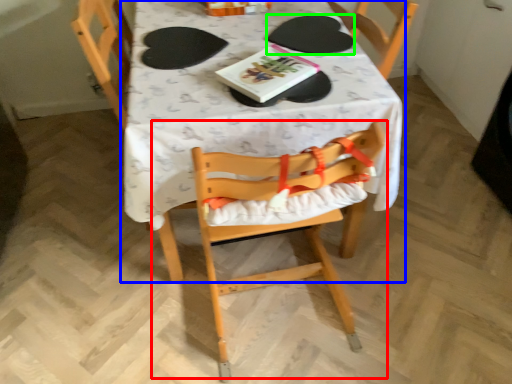
Question: Which object is the closest to the chair (highlighted by a red box)? Choose among these: table (highlighted by a blue box) or paper plate (highlighted by a green box).

Choices:
 (A) table
 (B) paper plate

Answer: (A)